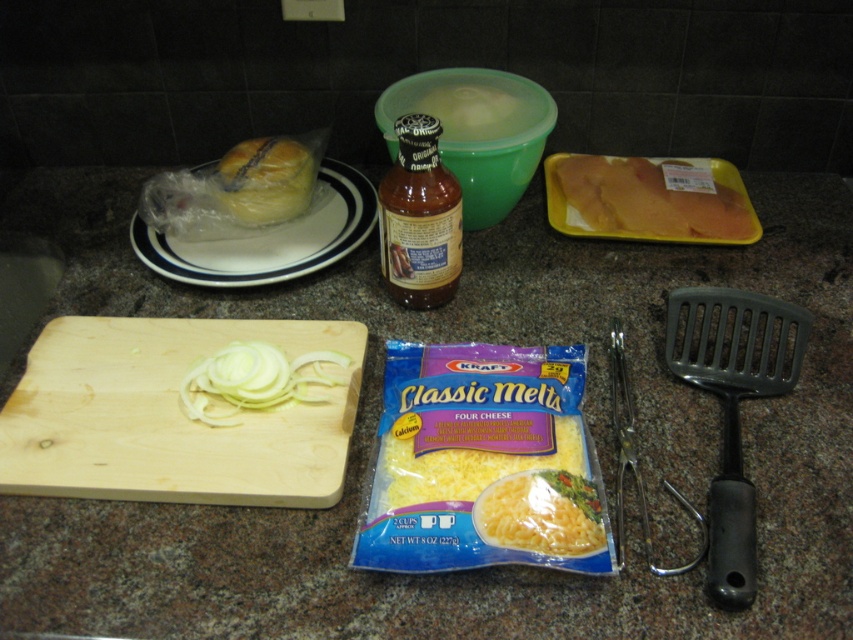
Can you confirm if white creamy pasta at center is taller than white matte bowl at center?

No.

Does white creamy pasta at center have a lesser height compared to white matte bowl at center?

Yes, white creamy pasta at center is shorter than white matte bowl at center.

Does point (575, 483) come farther from viewer compared to point (502, 115)?

No.

Find the location of `white creamy pasta at center`. white creamy pasta at center is located at coordinates (541, 513).

Can you confirm if white shredded cheese at center is shorter than white matte bowl at center?

Correct, white shredded cheese at center is not as tall as white matte bowl at center.

Measure the distance between white shredded cheese at center and camera.

A distance of 24.69 inches exists between white shredded cheese at center and camera.

Where is `white shredded cheese at center`? This screenshot has width=853, height=640. white shredded cheese at center is located at coordinates (468, 467).

Image resolution: width=853 pixels, height=640 pixels. Find the location of `white creamy pasta at center`. white creamy pasta at center is located at coordinates (541, 513).

Is point (526, 532) positioned behind point (410, 438)?

No, (526, 532) is closer to viewer.

Who is more distant from viewer, (526,524) or (480,468)?

Positioned behind is point (480,468).

Locate an element on the screen. Image resolution: width=853 pixels, height=640 pixels. white creamy pasta at center is located at coordinates (541, 513).